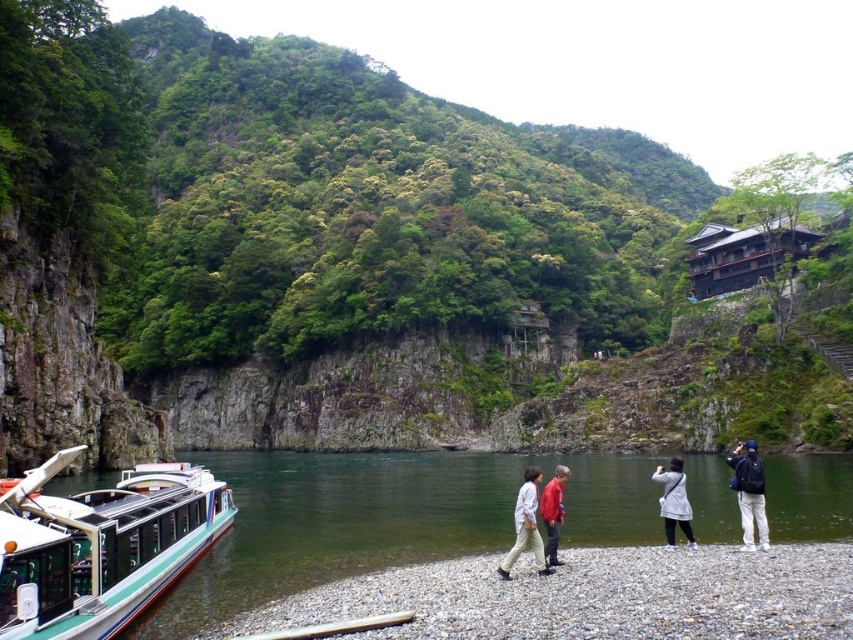
You are a photographer trying to capture a group photo of the light gray fabric coat at lower center and the red matte jacket at center. Which of the two should you focus on first if you want to ensure both are in frame without moving the camera?

The light gray fabric coat at lower center is bigger than the red matte jacket at center, so you should focus on the light gray fabric coat at lower center first to ensure it fits within the frame before adjusting for the smaller red matte jacket at center.

Looking at this image, you are standing at the center of the image and want to place a new red flag at the same position as the dark blue backpack at lower right. What are the coordinates where you should place the flag?

The coordinates for the dark blue backpack at lower right are (749, 492), so you should place the red flag at those coordinates.

You are standing on the riverside and see the green smooth water at lower center and the red matte jacket at center. Which object is closer to the ground?

The green smooth water at lower center is closer to the ground because it is below the red matte jacket at center.